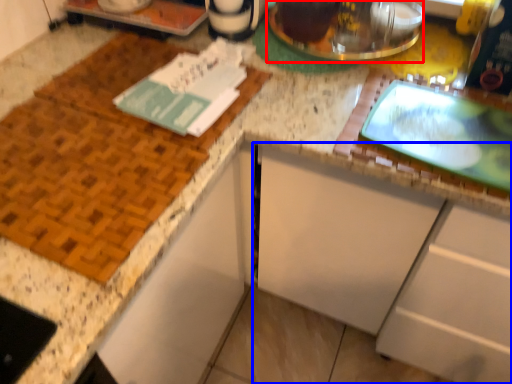
Question: Among these objects, which one is farthest to the camera, appliance (highlighted by a red box) or cabinetry (highlighted by a blue box)?

Choices:
 (A) appliance
 (B) cabinetry

Answer: (A)